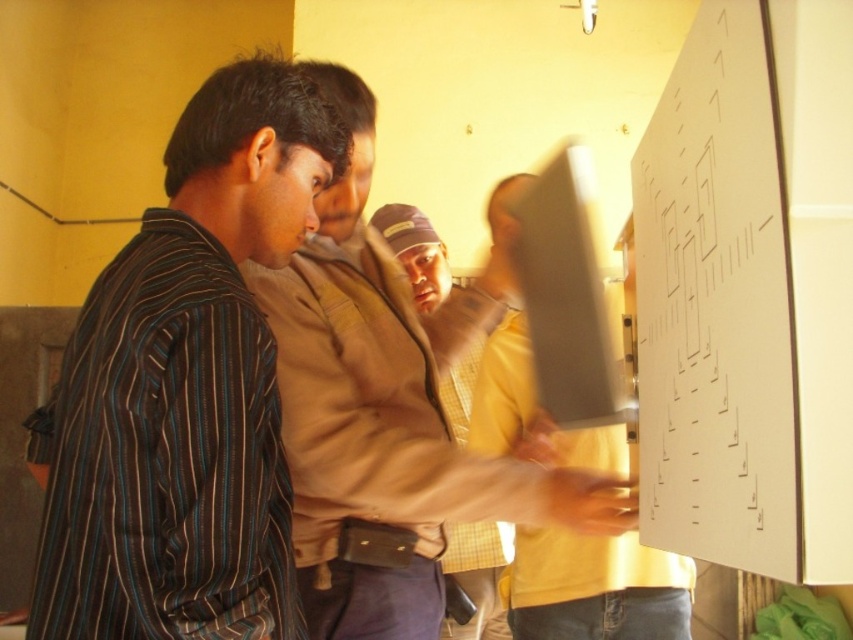
You are part of a team working on a whiteboard. You need to pass a marker to the person in the striped fabric shirt at left without disturbing the person in the brown leather jacket at center. How can you do this?

Since the striped fabric shirt at left is positioned on the left side of the brown leather jacket at center, you can pass the marker around the left side of the brown leather jacket at center to reach the striped fabric shirt at left without disturbing them.